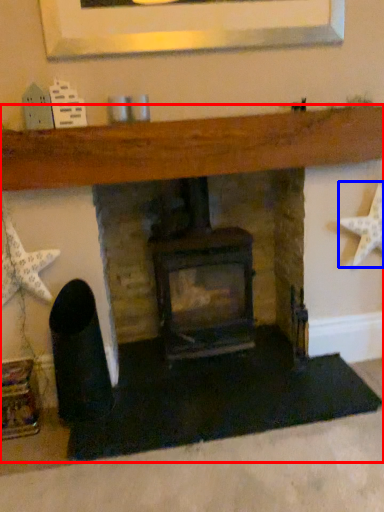
Question: Among these objects, which one is nearest to the camera, fireplace (highlighted by a red box) or starfish (highlighted by a blue box)?

Choices:
 (A) fireplace
 (B) starfish

Answer: (A)